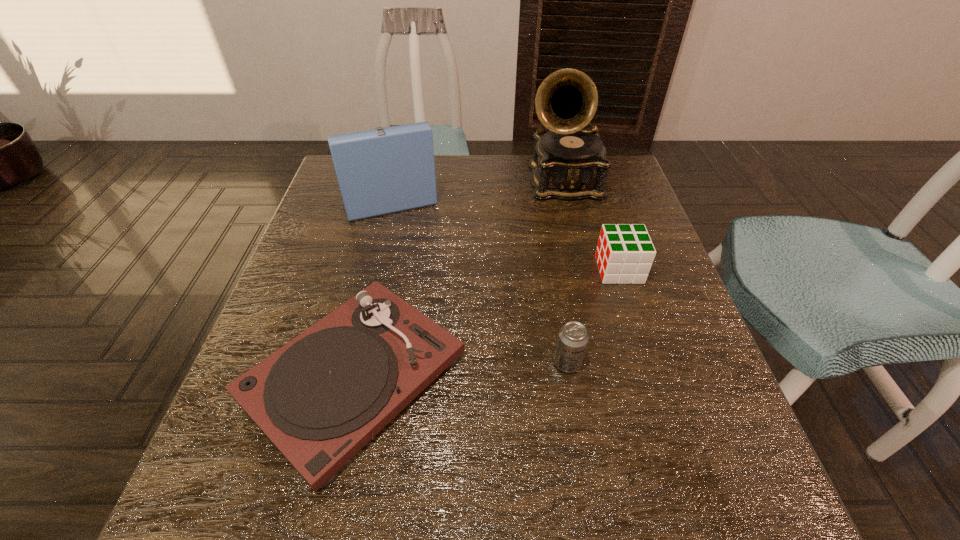
The height and width of the screenshot is (540, 960). Identify the location of the closest phonograph_record to the nearest phonograph_record. (381, 171).